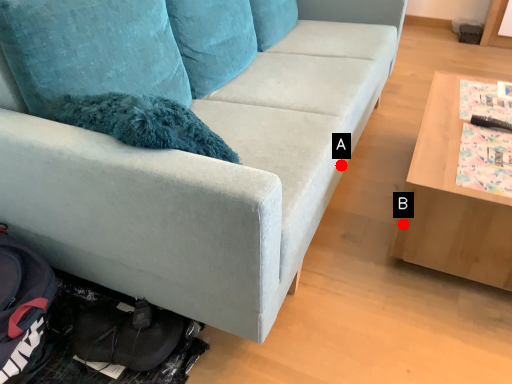
Question: Two points are circled on the image, labeled by A and B beside each circle. Which point is further to the camera?

Choices:
 (A) A is further
 (B) B is further

Answer: (A)